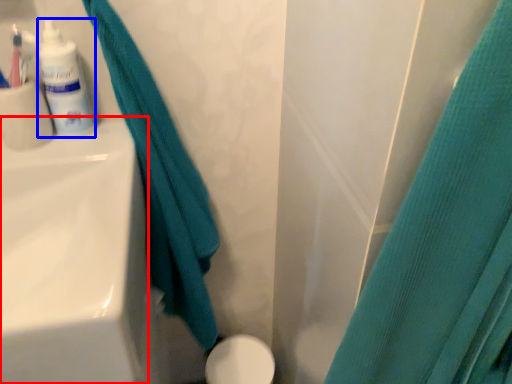
Question: Which object is closer to the camera taking this photo, sink (highlighted by a red box) or toiletry (highlighted by a blue box)?

Choices:
 (A) sink
 (B) toiletry

Answer: (A)